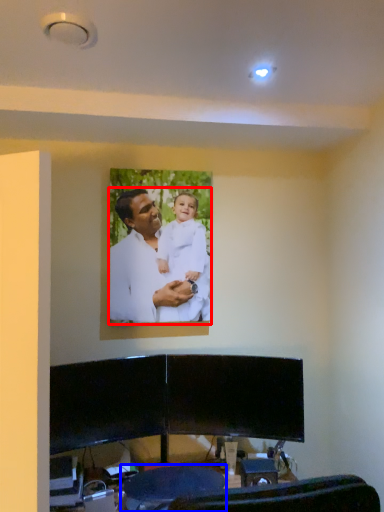
Question: Which of the following is the farthest to the observer, man (highlighted by a red box) or swivel chair (highlighted by a blue box)?

Choices:
 (A) man
 (B) swivel chair

Answer: (A)